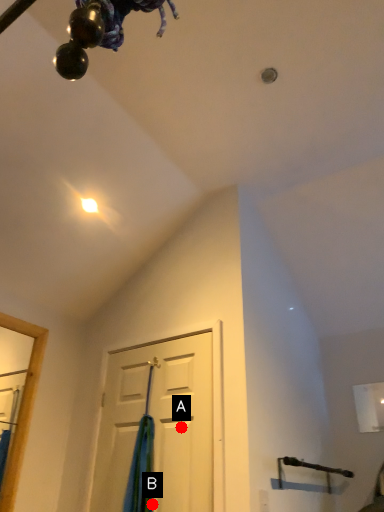
Question: Two points are circled on the image, labeled by A and B beside each circle. Among these points, which one is nearest to the camera?

Choices:
 (A) A is closer
 (B) B is closer

Answer: (B)